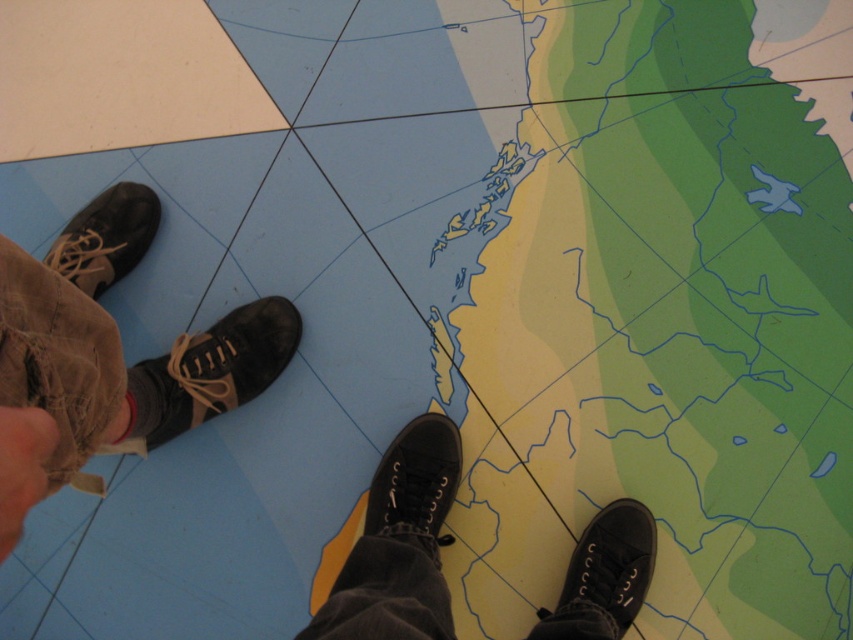
You are standing on the green matte map at center and want to step onto the matte black shoe at left. Given that the map is elevated, can you step onto the shoe without any obstacles?

The green matte map at center is taller than matte black shoe at left, so stepping onto the shoe would require descending from the map to the lower level where the shoe is located.

You are standing on the green matte map at center and want to step onto the black canvas shoe at lower right. Which direction should you move to reach it?

Since the green matte map at center is further to the viewer than the black canvas shoe at lower right, you would need to move forward towards the lower right direction to reach it.

You are standing in a room with a large map on the floor. You see a point marked at coordinates (71, 419). If you want to place a 20 inch wide object exactly at that point, will it fit without overlapping the edges of the map?

The distance of point (71, 419) from viewer is 32.27 inches. Since the object is 20 inches wide, it will fit as long as the map extends at least 10 inches beyond the point in all directions. However, without knowing the map dimensions, we cannot confirm. But based on the given distance, the point itself is 32.27 inches away, so the object might fit if positioned carefully.